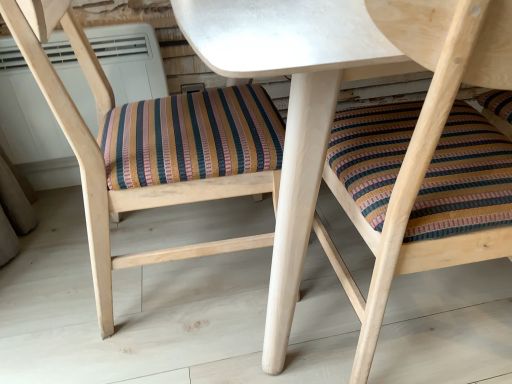
Question: Do you think multicolored woven cushion at center, the 2th chair from the right, is within white matte table at center, or outside of it?

Choices:
 (A) outside
 (B) inside

Answer: (B)

Question: Relative to white matte table at center, is multicolored woven cushion at center, the 2th chair from the right, in front or behind?

Choices:
 (A) front
 (B) behind

Answer: (B)

Question: Which object is the closest to the multicolored woven cushion at center, the first chair viewed from the left?

Choices:
 (A) wooden chair with striped cushion at center, the second chair when ordered from left to right
 (B) white matte table at center
 (C) white plastic air conditioner at upper center

Answer: (B)

Question: Which of these objects is positioned closest to the multicolored woven cushion at center, the first chair viewed from the left?

Choices:
 (A) white matte table at center
 (B) wooden chair with striped cushion at center, marked as the first chair in a right-to-left arrangement
 (C) white plastic air conditioner at upper center

Answer: (A)